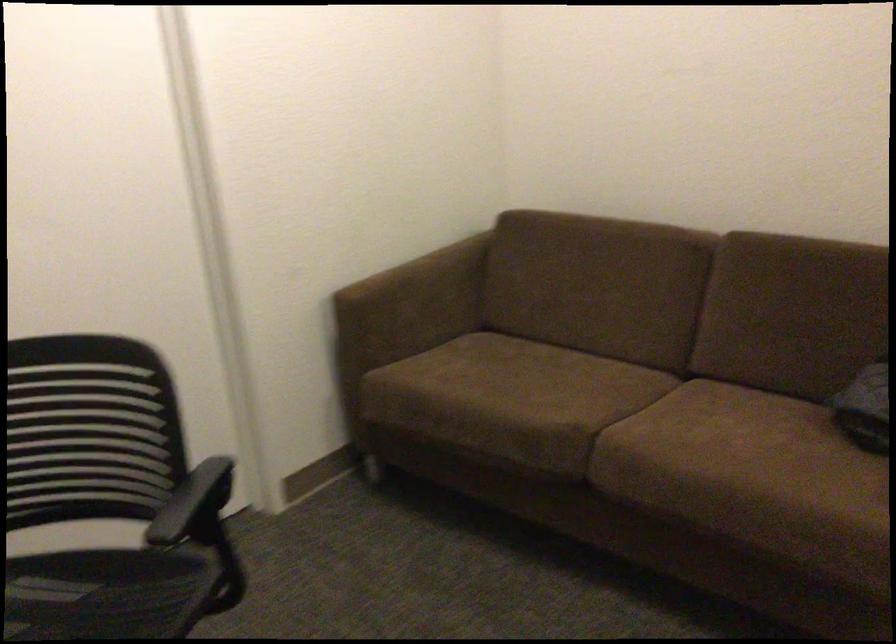
Locate an element on the screen. The height and width of the screenshot is (644, 896). sofa sitting surface is located at coordinates (726, 462).